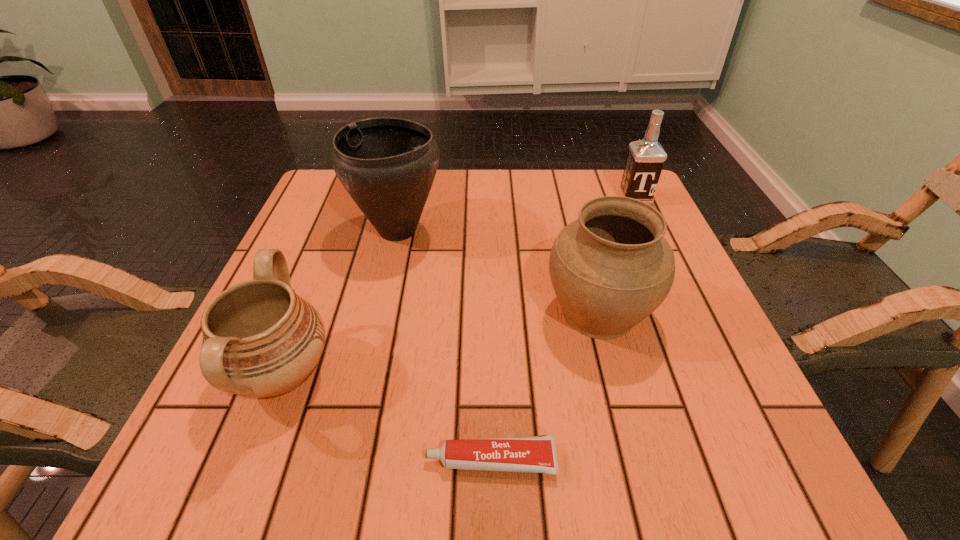
Where is `vacant space at the far edge of the desktop`? This screenshot has height=540, width=960. vacant space at the far edge of the desktop is located at coordinates (490, 182).

Where is `free space at the near edge of the desktop`? Image resolution: width=960 pixels, height=540 pixels. free space at the near edge of the desktop is located at coordinates (442, 431).

Identify the location of vacant region at the right edge of the desktop. (691, 358).

In the image, there is a desktop. Where is `blank space at the far left corner`? This screenshot has width=960, height=540. blank space at the far left corner is located at coordinates (322, 204).

In order to click on vacant area between the rightmost urn and the shortest object in this screenshot , I will do `click(544, 386)`.

The image size is (960, 540). In order to click on vacant space that is in between the farthest urn and the shortest object in this screenshot , I will do `click(444, 345)`.

Identify the location of vacant point located between the nearest object and the rightmost object. The height and width of the screenshot is (540, 960). (563, 329).

Locate an element on the screen. This screenshot has height=540, width=960. free space between the second object from right to left and the farthest urn is located at coordinates (498, 271).

Locate an element on the screen. This screenshot has height=540, width=960. empty location between the vodka and the shortest object is located at coordinates [x=563, y=329].

The image size is (960, 540). Identify the location of empty location between the rightmost object and the nearest object. (563, 329).